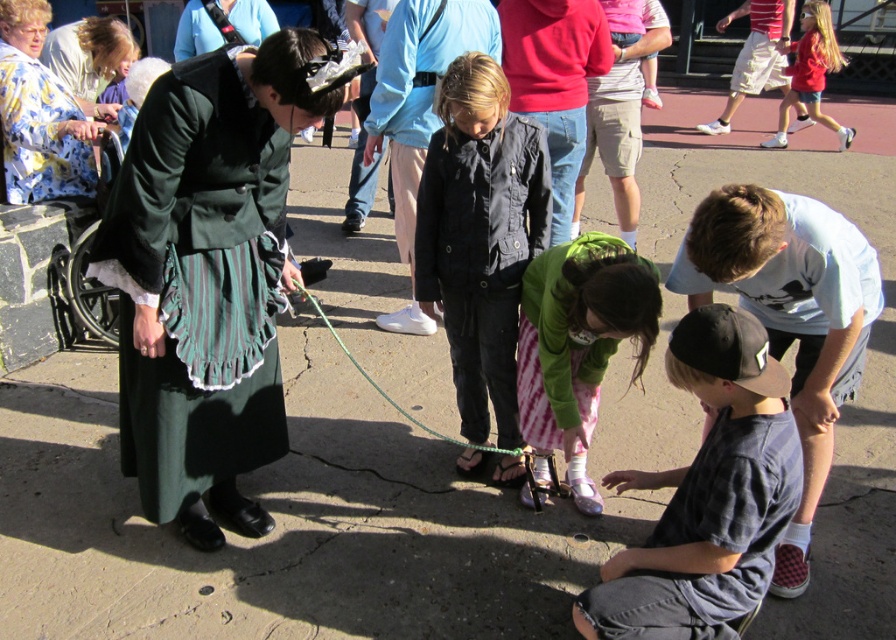
You are a photographer trying to capture a candid shot of the dark blue cotton shirt at lower right and the floral silk robe at upper left. To ensure both subjects are in frame, which direction should you move your camera to include both? Please specify the direction based on their positions relative to each other.

Since the dark blue cotton shirt at lower right is positioned on the right side of the floral silk robe at upper left, you should pan your camera to the right to include both subjects in the frame.

You are standing at the center of the scene and want to locate the dark blue cotton shirt at lower right. Which direction should you face to see it?

The dark blue cotton shirt at lower right is located at point (x=708, y=492), so you should face towards the lower right direction to see it.

You are a photographer trying to capture a candid shot of the dark blue cotton shirt at lower right and the pink striped skirt at center without them noticing. Since you want to ensure both subjects are in focus, which one should you focus on first to maintain depth of field?

The dark blue cotton shirt at lower right is closer to the viewer than the pink striped skirt at center. To maintain depth of field, focus on the closer subject first, so focus on the dark blue cotton shirt at lower right first.